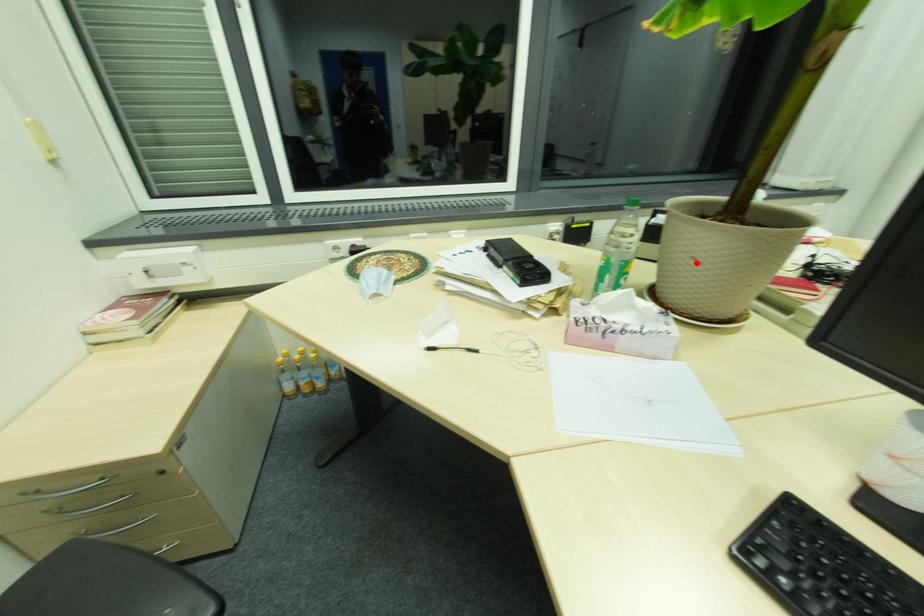
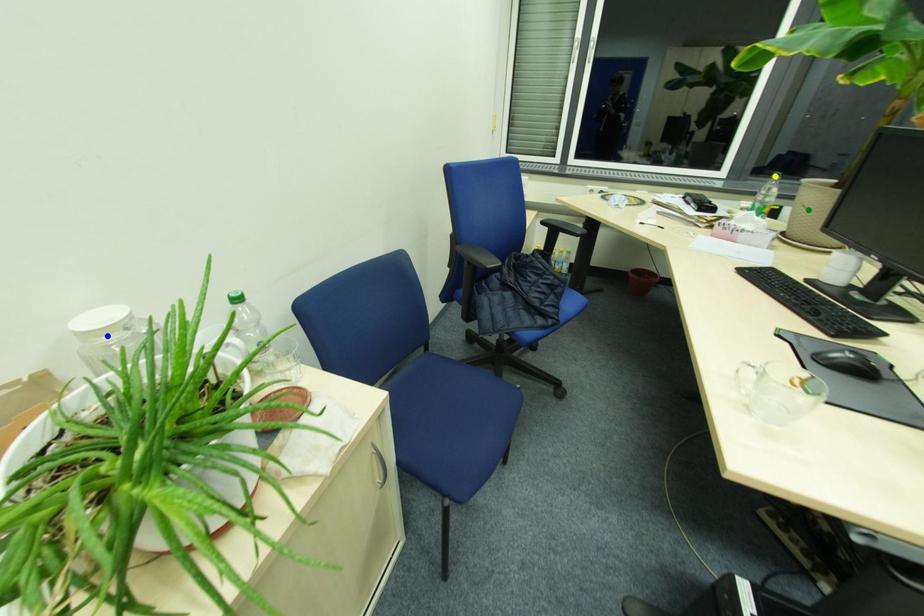
Question: I am providing you with two images of the same scene from different viewpoints. A red point is marked on the first image. You are given multiple points on the second image. Which spot in image 2 lines up with the point in image 1?

Choices:
 (A) blue point
 (B) yellow point
 (C) green point

Answer: (C)